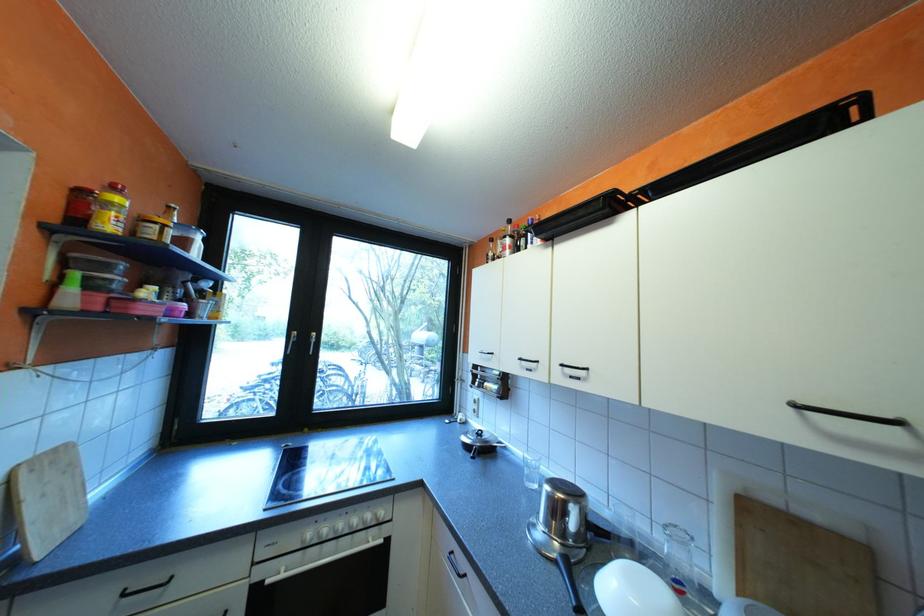
Find where to lift the brown glass bottle. Please return your answer as a coordinate pair (x, y).

(491, 249)